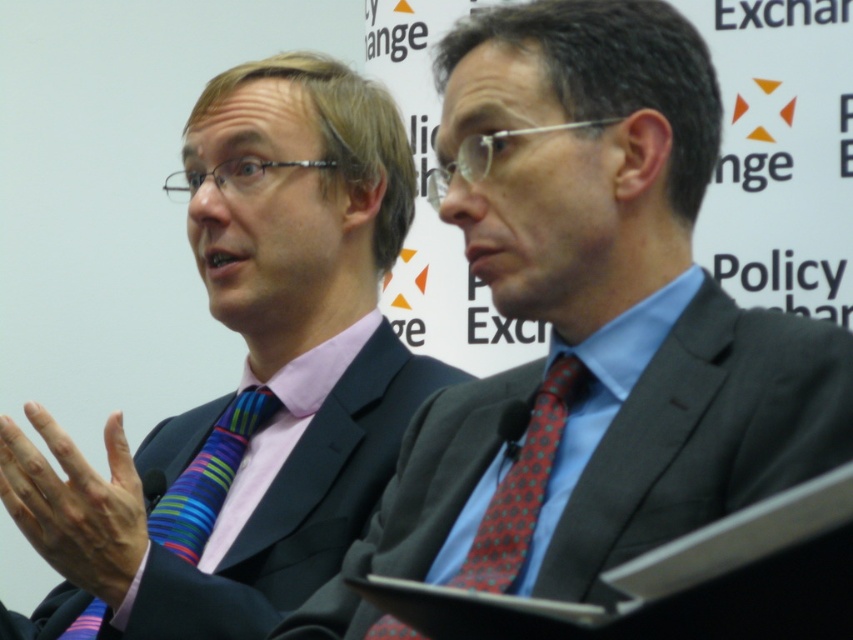
Is point (664, 252) positioned after point (74, 570)?

That is True.

Identify the location of matte black suit at center. (589, 324).

Which is in front, point (560, 44) or point (198, 516)?

Point (560, 44) is in front.

Where is `matte black suit at center`? The width and height of the screenshot is (853, 640). matte black suit at center is located at coordinates (589, 324).

Is point (252, 218) farther from viewer compared to point (96, 625)?

Yes, it is behind point (96, 625).

Can you confirm if matte black suit at left is positioned to the left of striped silk tie at left?

Indeed, matte black suit at left is positioned on the left side of striped silk tie at left.

Locate an element on the screen. matte black suit at left is located at coordinates (247, 378).

Measure the distance between matte black suit at center and camera.

matte black suit at center is 20.27 meters away from camera.

Is point (665, 490) less distant than point (566, 392)?

Yes.

This screenshot has width=853, height=640. Find the location of `matte black suit at center`. matte black suit at center is located at coordinates (589, 324).